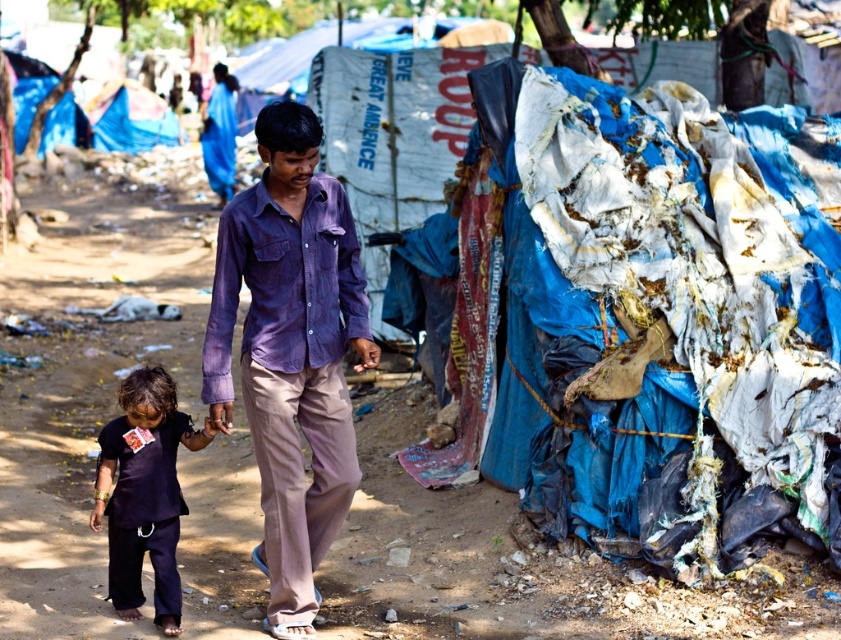
You are a hiker who has lost your way in a remote area. You come across this scene with the ragged plastic bags at right and the purple cotton shirt at center. Which object is taller and could potentially be used as a landmark for navigation?

The ragged plastic bags at right is much taller than the purple cotton shirt at center, so it can be used as a landmark for navigation.

You are a hiker who has lost your way in a remote area. You see the ragged plastic bags at right and the purple cotton shirt at center. Which object would you choose to use as a makeshift shelter and why?

The ragged plastic bags at right are larger in size than the purple cotton shirt at center, so they would be more suitable for creating a makeshift shelter due to their greater size and material, which can provide better protection from the elements.

You are a photographer trying to capture a detailed shot of both the purple corduroy shirt at center and the purple cotton shirt at center. Since you can only focus on one at a time, which shirt should you focus on first to ensure it appears sharp in the photo?

The purple corduroy shirt at center is closer to the viewer than the purple cotton shirt at center, so focusing on it first will ensure it appears sharp. If you focus on the purple cotton shirt at center first, the purple corduroy shirt at center may appear blurry due to its closer proximity.